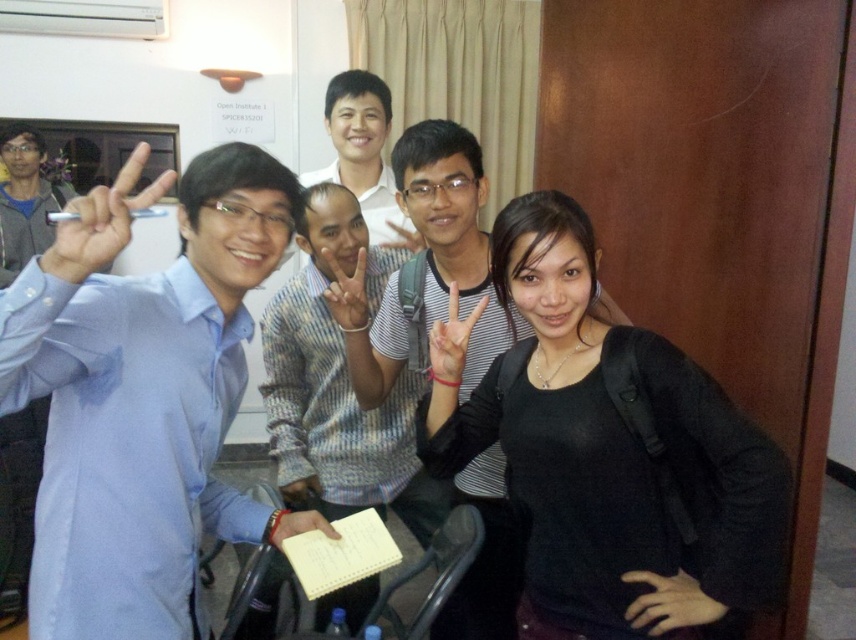
Can you confirm if striped sweater at center is positioned above matte white shirt at center?

Actually, striped sweater at center is below matte white shirt at center.

Locate an element on the screen. This screenshot has height=640, width=856. striped sweater at center is located at coordinates (339, 385).

Find the location of `matte black hand at center`. matte black hand at center is located at coordinates (452, 340).

Is matte black hand at center closer to camera compared to white paper at center?

Yes, matte black hand at center is in front of white paper at center.

Who is more distant from viewer, (x=459, y=378) or (x=282, y=528)?

The point (x=459, y=378) is behind.

Locate an element on the screen. This screenshot has width=856, height=640. matte black hand at center is located at coordinates (452, 340).

Can you confirm if striped sweater at center is shorter than matte black hand at center?

No.

Can you confirm if striped sweater at center is thinner than matte black hand at center?

Incorrect, striped sweater at center's width is not less than matte black hand at center's.

Describe the element at coordinates (339, 385) in the screenshot. The width and height of the screenshot is (856, 640). I see `striped sweater at center` at that location.

This screenshot has height=640, width=856. I want to click on striped sweater at center, so (339, 385).